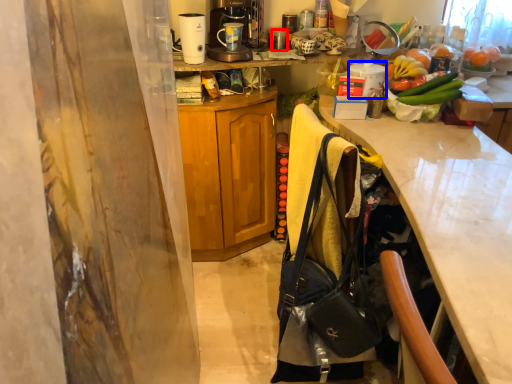
Question: Among these objects, which one is nearest to the camera, appliance (highlighted by a red box) or appliance (highlighted by a blue box)?

Choices:
 (A) appliance
 (B) appliance

Answer: (B)